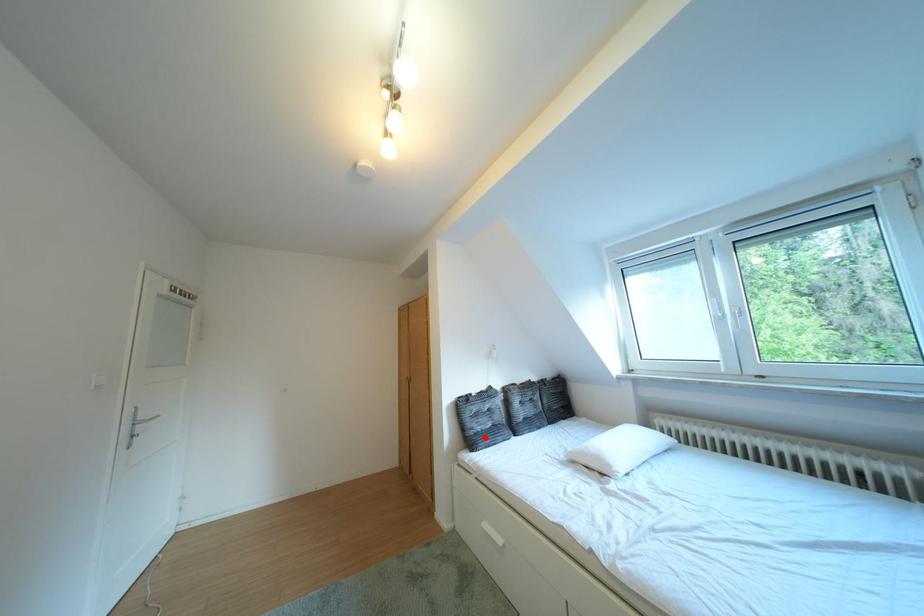
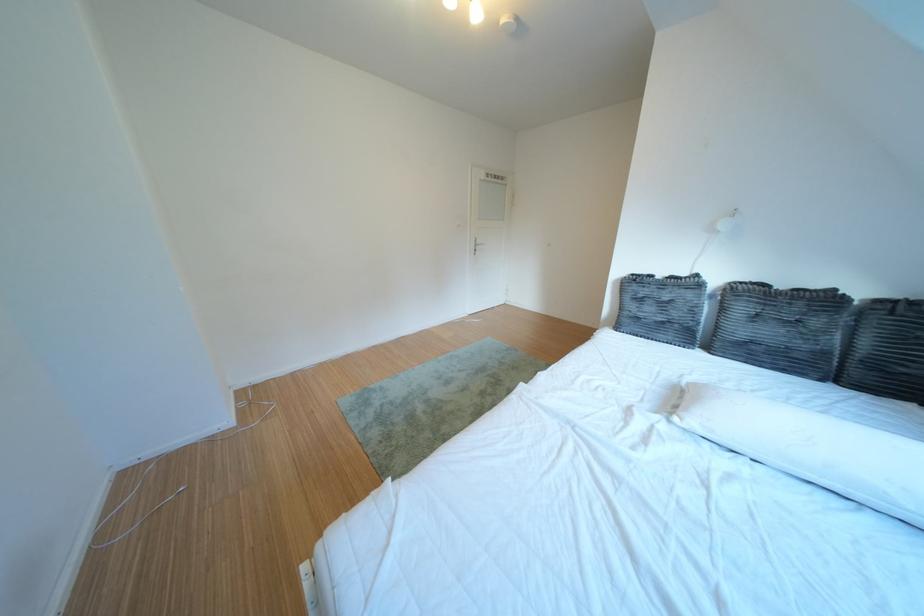
Question: I am providing you with two images of the same scene from different viewpoints. Given a red point in image1, look at the same physical point in image2. Is it:

Choices:
 (A) Closer to the viewpoint
 (B) Farther from the viewpoint

Answer: (A)